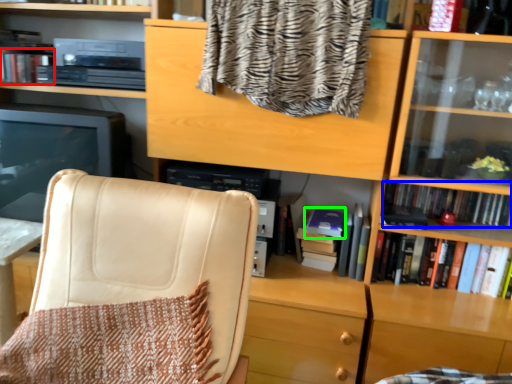
Question: Which object is the farthest from book (highlighted by a red box)? Choose among these: book (highlighted by a blue box) or paperback book (highlighted by a green box).

Choices:
 (A) book
 (B) paperback book

Answer: (A)